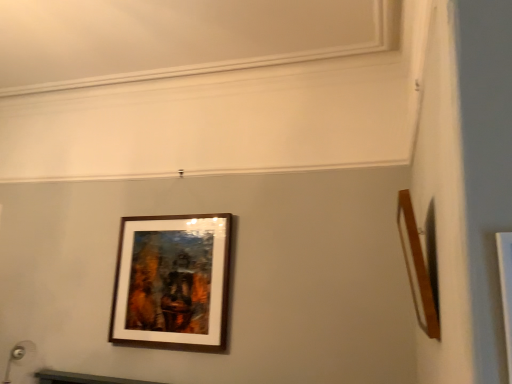
Question: In the image, is wooden frame at right, the 2th picture frame in the left-to-right sequence, positioned in front of or behind wooden frame at center, which appears as the first picture frame when viewed from the back?

Choices:
 (A) behind
 (B) front

Answer: (B)

Question: Based on their sizes in the image, would you say wooden frame at right, which is the 1th picture frame in right-to-left order, is bigger or smaller than wooden frame at center, which ranks as the 2th picture frame in front-to-back order?

Choices:
 (A) small
 (B) big

Answer: (A)

Question: Looking at their shapes, would you say wooden frame at right, the second picture frame positioned from the back, is wider or thinner than wooden frame at center, which ranks as the 2th picture frame in front-to-back order?

Choices:
 (A) thin
 (B) wide

Answer: (B)

Question: Visually, is wooden frame at center, which appears as the first picture frame when viewed from the back, positioned to the left or to the right of wooden frame at right, the second picture frame positioned from the back?

Choices:
 (A) right
 (B) left

Answer: (B)

Question: From the image's perspective, is wooden frame at center, which ranks as the 2th picture frame in front-to-back order, located above or below wooden frame at right, which is the 1th picture frame in right-to-left order?

Choices:
 (A) below
 (B) above

Answer: (A)

Question: Is point (201, 283) closer or farther from the camera than point (432, 322)?

Choices:
 (A) closer
 (B) farther

Answer: (B)

Question: Based on their sizes in the image, would you say wooden frame at center, positioned as the 1th picture frame in left-to-right order, is bigger or smaller than wooden frame at right, the second picture frame positioned from the back?

Choices:
 (A) small
 (B) big

Answer: (B)